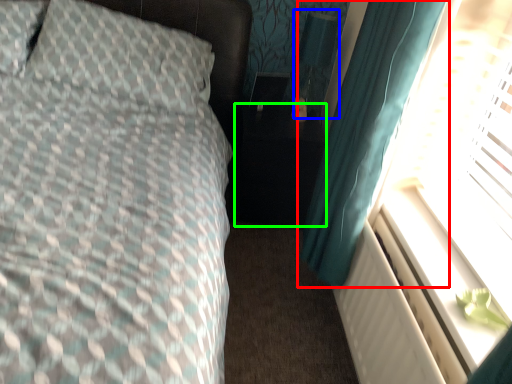
Question: Which object is the closest to the curtain (highlighted by a red box)? Choose among these: table lamp (highlighted by a blue box) or side table (highlighted by a green box).

Choices:
 (A) table lamp
 (B) side table

Answer: (B)